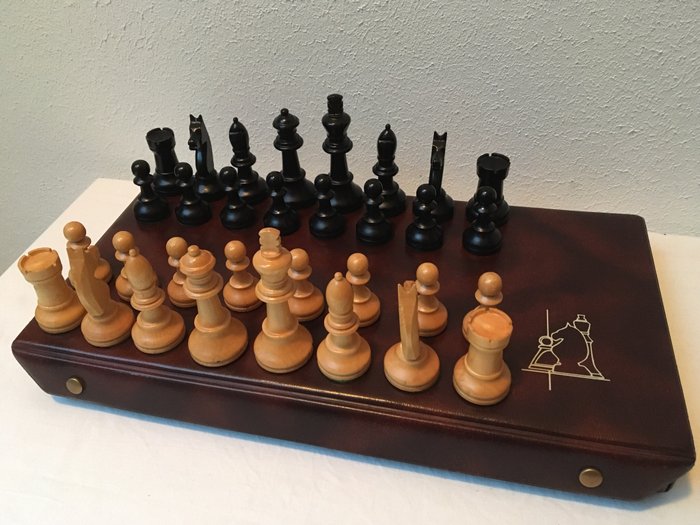
At what (x,y) coordinates should I click in order to perform the action: click on chess set. Please return your answer as a coordinate pair (x, y). Looking at the image, I should click on (570, 265).